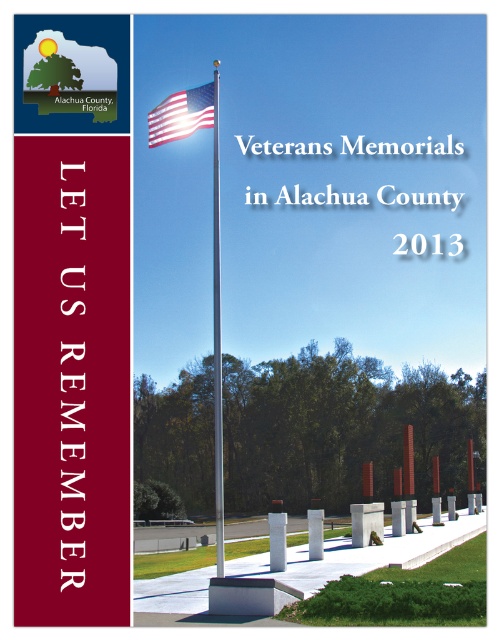
Between point (217, 259) and point (198, 97), which one is positioned in front?

Point (217, 259) is more forward.

Locate an element on the screen. The image size is (499, 640). polished metal flag pole at center is located at coordinates (217, 337).

Find the location of a particular element. polished metal flag pole at center is located at coordinates (217, 337).

Who is positioned more to the right, polished metal flag pole at center or white polished stone pillar at center?

From the viewer's perspective, white polished stone pillar at center appears more on the right side.

Looking at this image, is polished metal flag pole at center to the left of white polished stone pillar at center from the viewer's perspective?

Indeed, polished metal flag pole at center is positioned on the left side of white polished stone pillar at center.

Identify the location of polished metal flag pole at center. Image resolution: width=499 pixels, height=640 pixels. (217, 337).

Image resolution: width=499 pixels, height=640 pixels. In order to click on polished metal flag pole at center in this screenshot , I will do `click(217, 337)`.

Image resolution: width=499 pixels, height=640 pixels. Describe the element at coordinates (277, 540) in the screenshot. I see `white concrete pillar at center` at that location.

This screenshot has height=640, width=499. What are the coordinates of `white concrete pillar at center` in the screenshot? It's located at (277, 540).

Is point (281, 556) less distant than point (310, 560)?

Yes, it is in front of point (310, 560).

At what (x,y) coordinates should I click in order to perform the action: click on white concrete pillar at center. Please return your answer as a coordinate pair (x, y). The image size is (499, 640). Looking at the image, I should click on (277, 540).